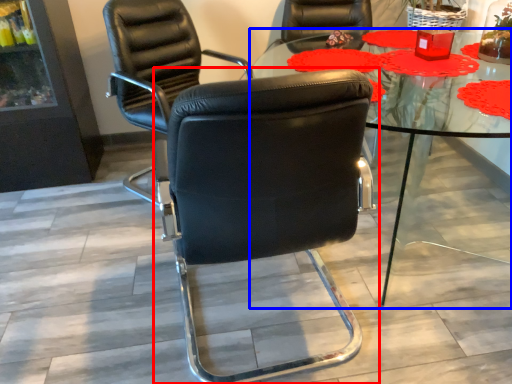
Question: Among these objects, which one is farthest to the camera, chair (highlighted by a red box) or table (highlighted by a blue box)?

Choices:
 (A) chair
 (B) table

Answer: (B)